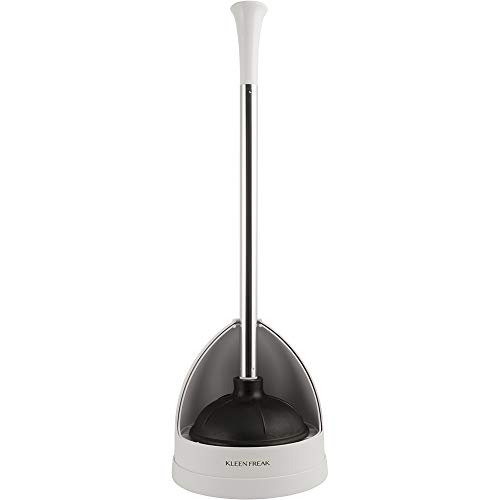
Image resolution: width=500 pixels, height=500 pixels. In order to click on plunger handle in this screenshot , I will do `click(243, 21)`.